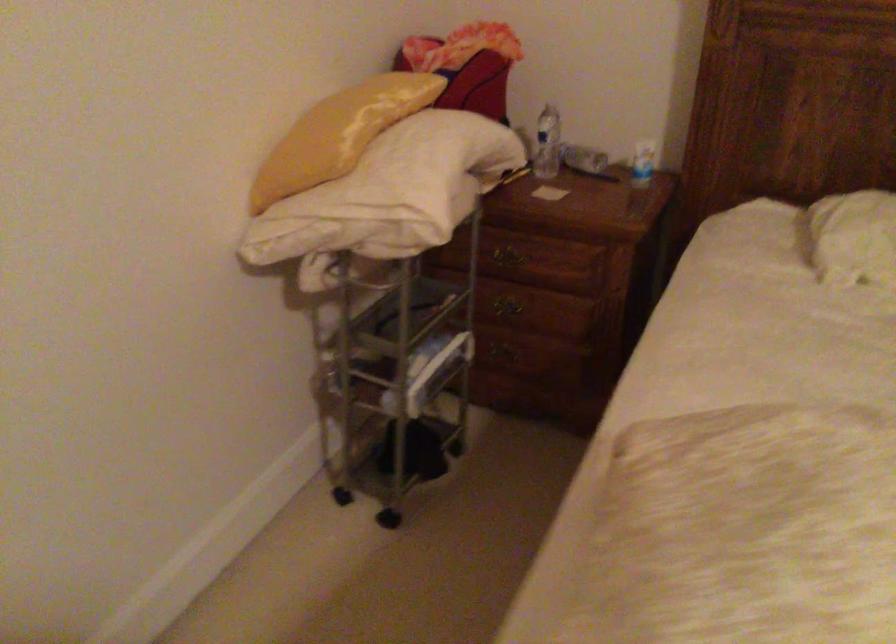
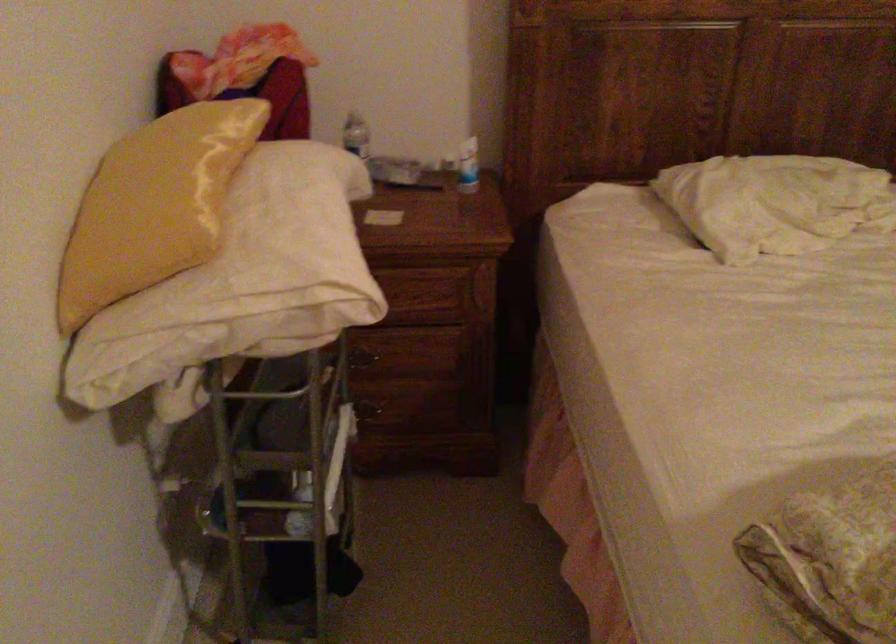
In the second image, find the point that corresponds to the point at 549,325 in the first image.

(412, 365)